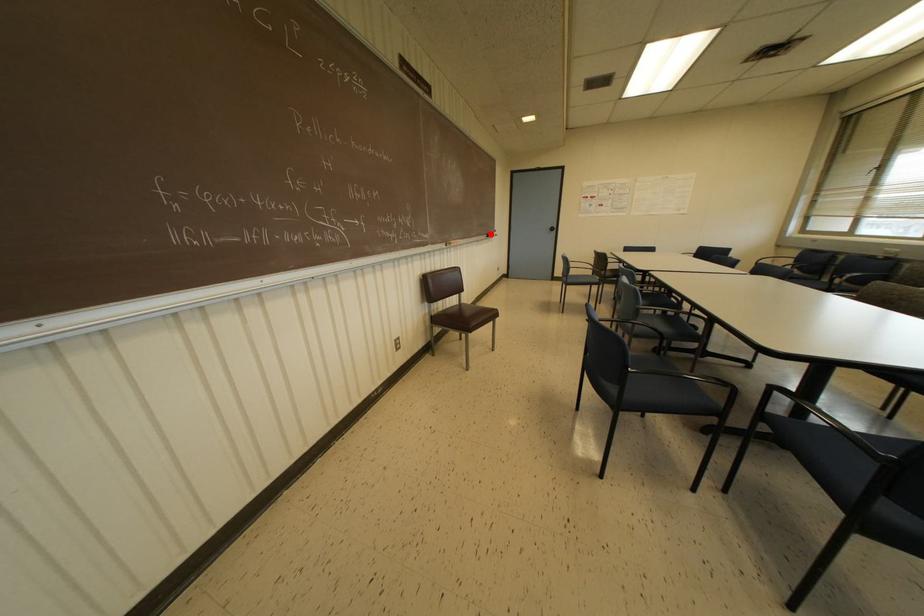
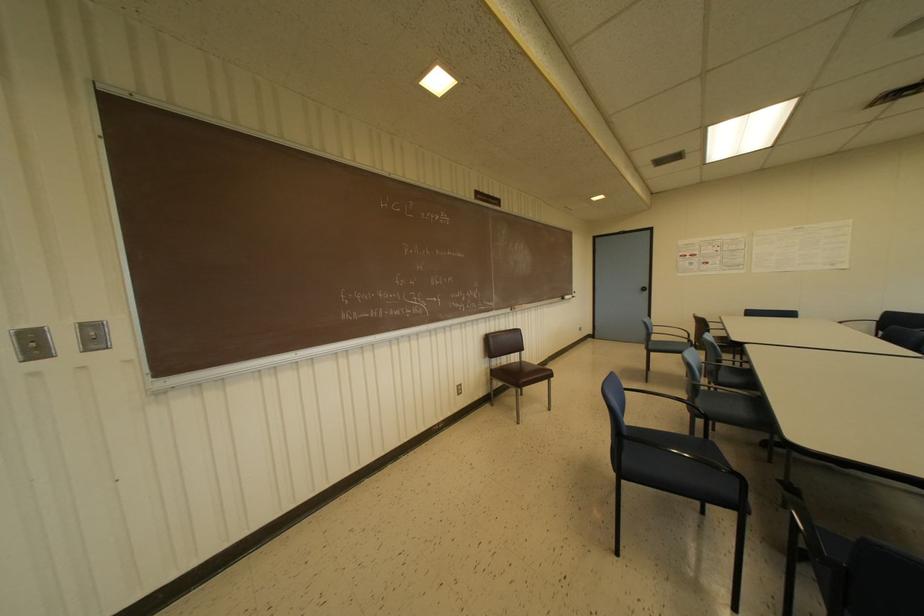
The point at the highlighted location is marked in the first image. Where is the corresponding point in the second image?

(565, 296)